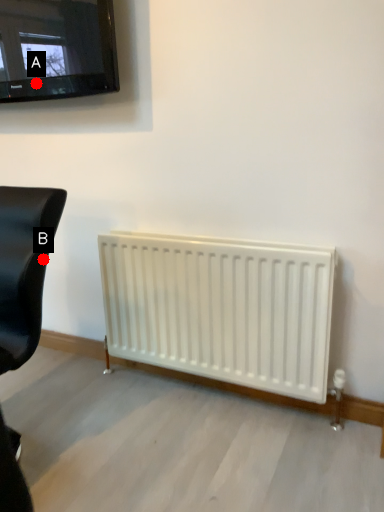
Question: Two points are circled on the image, labeled by A and B beside each circle. Which of the following is the closest to the observer?

Choices:
 (A) A is closer
 (B) B is closer

Answer: (B)